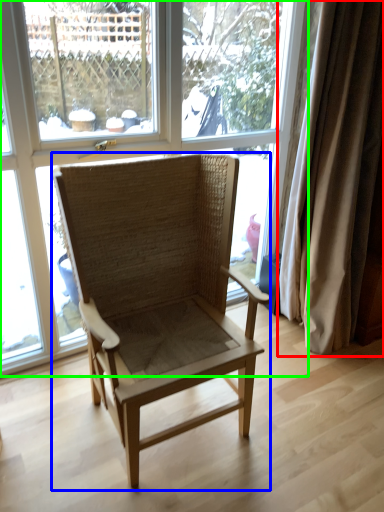
Question: Considering the real-world distances, which object is farthest from curtain (highlighted by a red box)? chair (highlighted by a blue box) or window (highlighted by a green box)?

Choices:
 (A) chair
 (B) window

Answer: (B)